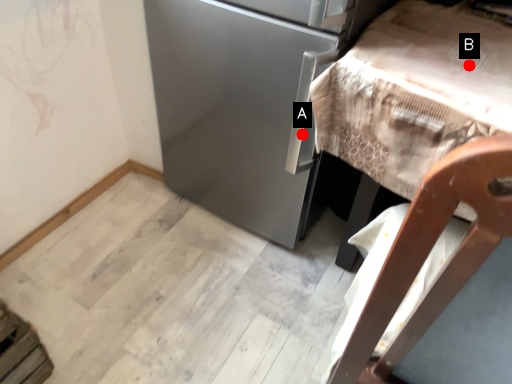
Question: Two points are circled on the image, labeled by A and B beside each circle. Which point is farther to the camera?

Choices:
 (A) A is further
 (B) B is further

Answer: (A)